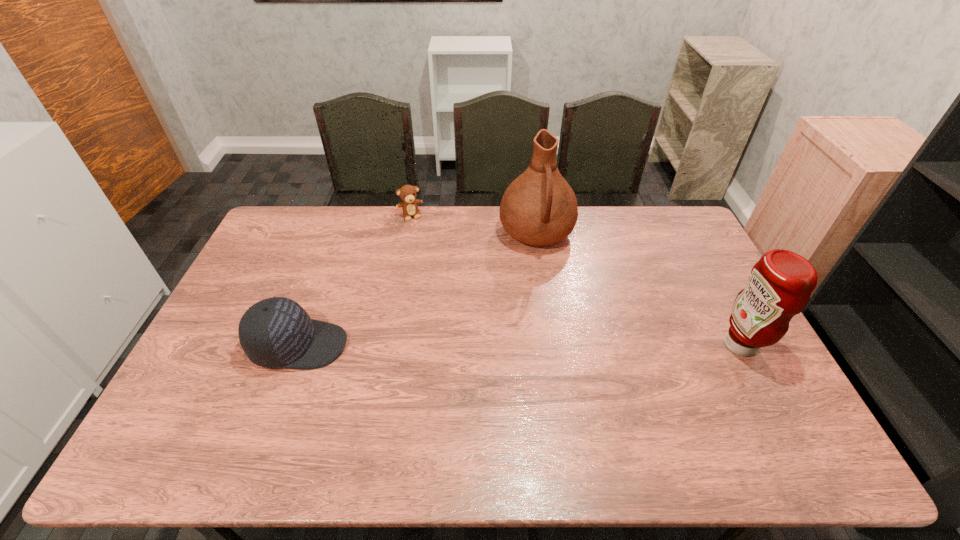
The image size is (960, 540). I want to click on vacant space at the far edge, so click(x=345, y=243).

I want to click on free region at the right edge of the desktop, so click(717, 341).

Locate an element on the screen. The width and height of the screenshot is (960, 540). vacant region at the far left corner of the desktop is located at coordinates (298, 214).

In the image, there is a desktop. In order to click on vacant space at the near left corner in this screenshot , I will do `click(207, 415)`.

Locate an element on the screen. blank space at the far right corner of the desktop is located at coordinates (676, 240).

Locate an element on the screen. unoccupied area between the pitcher and the second tallest object is located at coordinates (638, 289).

I want to click on free space that is in between the condiment and the baseball cap, so click(x=519, y=345).

Where is `empty space that is in between the leftmost object and the third object from right to left`? This screenshot has height=540, width=960. empty space that is in between the leftmost object and the third object from right to left is located at coordinates (355, 280).

Where is `vacant point located between the second object from left to right and the tallest object`? vacant point located between the second object from left to right and the tallest object is located at coordinates (473, 225).

Locate an element on the screen. The width and height of the screenshot is (960, 540). empty location between the condiment and the third tallest object is located at coordinates (519, 345).